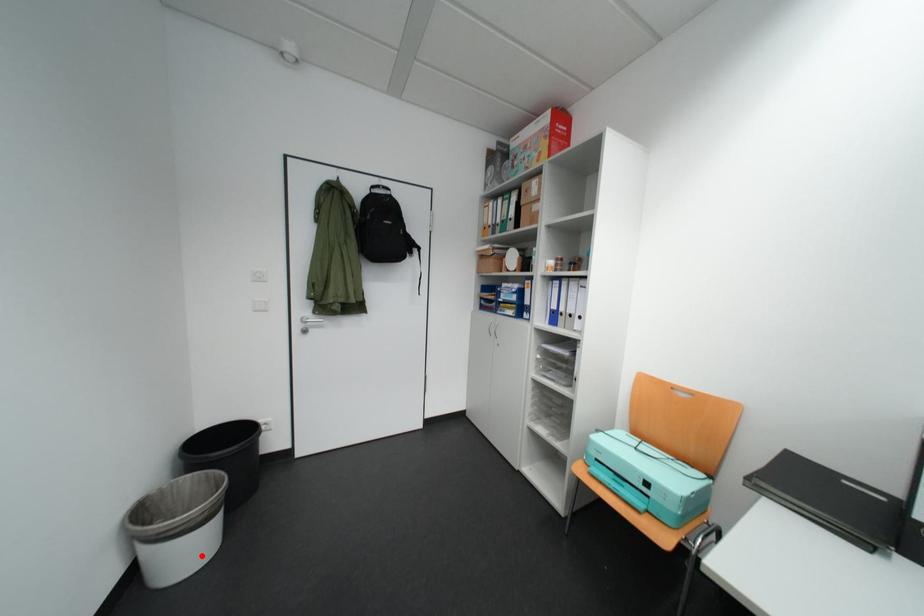
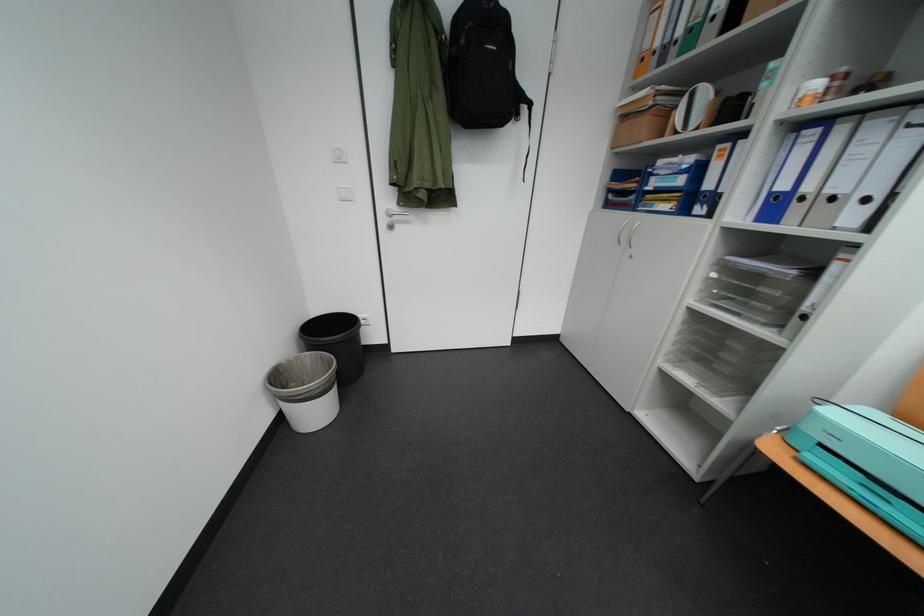
Locate, in the second image, the point that corresponds to the highlighted location in the first image.

(329, 415)